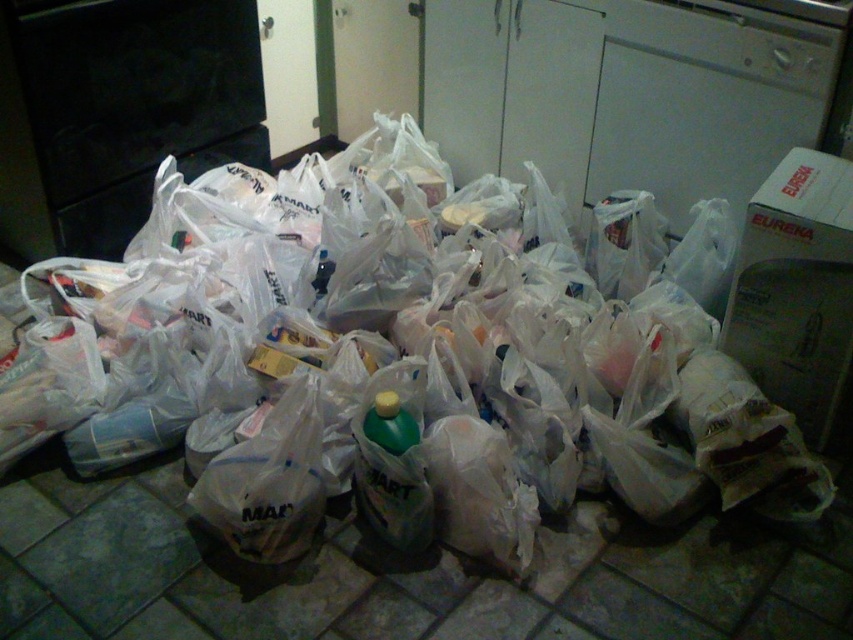
Question: Which point is closer to the camera?

Choices:
 (A) (415, 451)
 (B) (260, 109)
 (C) (476, 440)

Answer: (A)

Question: Can you confirm if black glossy oven at upper left is smaller than green plastic bottle at center?

Choices:
 (A) no
 (B) yes

Answer: (A)

Question: In this image, where is transparent plastic bags at center located relative to green plastic bottle at center?

Choices:
 (A) below
 (B) above

Answer: (B)

Question: Which point is farther from the camera taking this photo?

Choices:
 (A) (447, 358)
 (B) (410, 464)

Answer: (A)

Question: Based on their relative distances, which object is nearer to the transparent plastic bags at center?

Choices:
 (A) green plastic bottle at center
 (B) black glossy oven at upper left

Answer: (A)

Question: Can you confirm if transparent plastic bags at center is positioned to the left of black glossy oven at upper left?

Choices:
 (A) yes
 (B) no

Answer: (B)